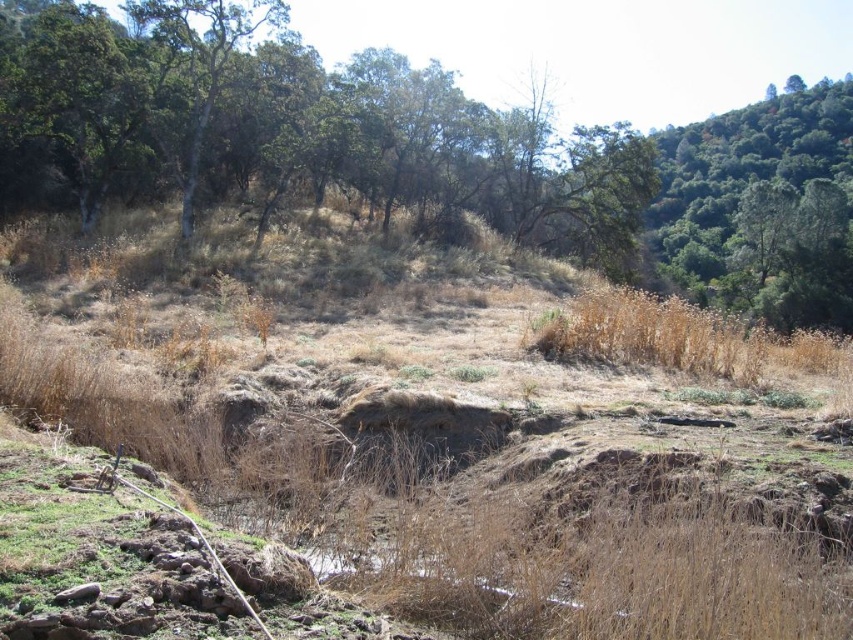
You are a hiker trying to navigate through the landscape. You see the brown grassy hillside at center and the green leafy tree at upper right. Which object would you estimate has a smaller width when viewed from above?

The brown grassy hillside at center is thinner than the green leafy tree at upper right, so the brown grassy hillside at center has a smaller width when viewed from above.